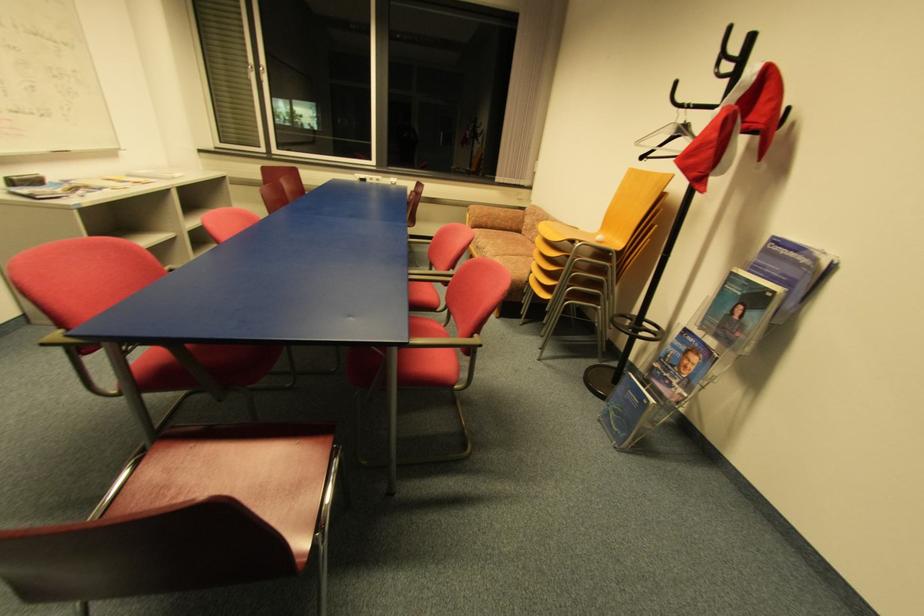
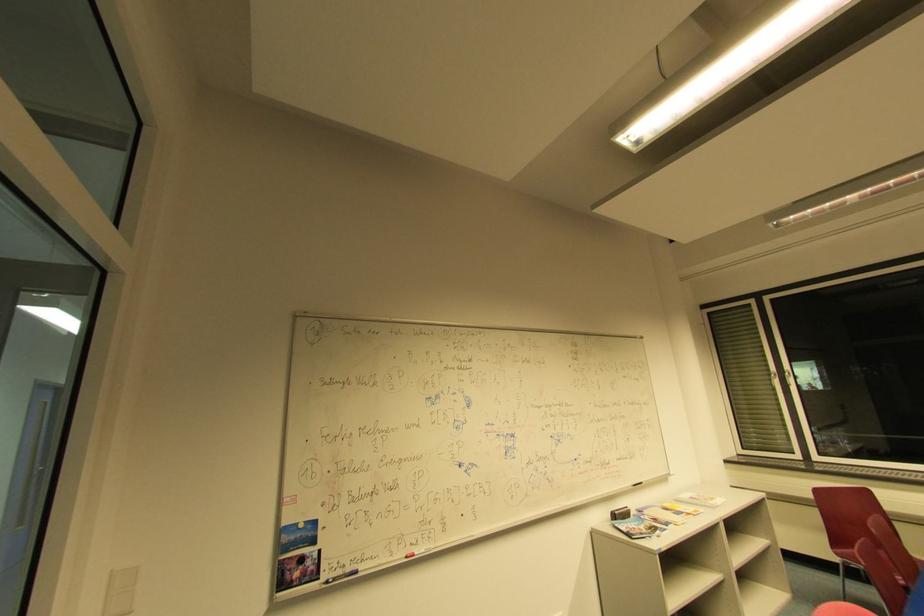
The images are taken continuously from a first-person perspective. In which direction is your viewpoint rotating?

The camera rotated toward left-up.